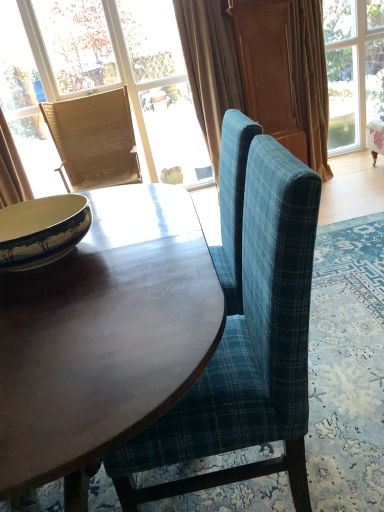
What are the coordinates of `vacant area located to the right-hand side of yellow glazed bowl at left` in the screenshot? It's located at (144, 234).